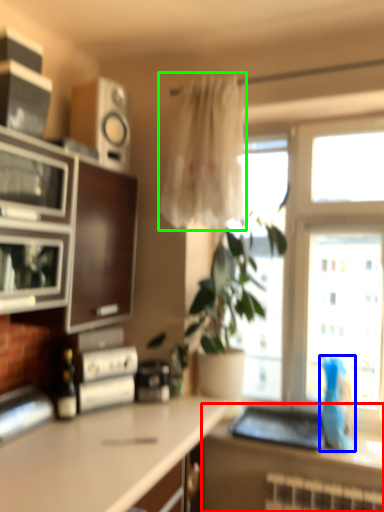
Question: Estimate the real-world distances between objects in this image. Which object is farther from countertop (highlighted by a red box), parrot (highlighted by a blue box) or curtain (highlighted by a green box)?

Choices:
 (A) parrot
 (B) curtain

Answer: (B)